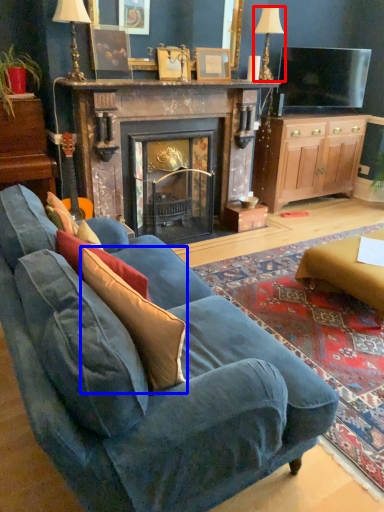
Question: Which point is further to the camera, lamp (highlighted by a red box) or throw pillow (highlighted by a blue box)?

Choices:
 (A) lamp
 (B) throw pillow

Answer: (A)